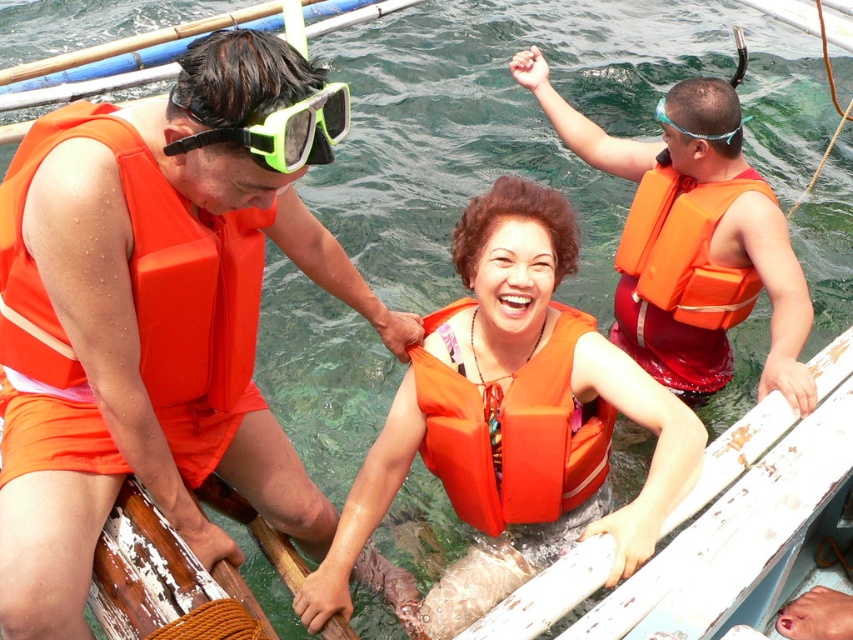
Question: Is orange life vest at center bigger than teal plastic goggles at upper center?

Choices:
 (A) yes
 (B) no

Answer: (B)

Question: Is the position of orange foam life jacket at left less distant than that of orange matte life jacket at right?

Choices:
 (A) no
 (B) yes

Answer: (B)

Question: Which of the following is the closest to the observer?

Choices:
 (A) (672, 100)
 (B) (647, 508)
 (C) (267, 116)
 (D) (461, 410)

Answer: (C)

Question: Estimate the real-world distances between objects in this image. Which object is closer to the orange matte life jacket at right?

Choices:
 (A) orange foam life jacket at left
 (B) teal plastic goggles at upper center

Answer: (B)

Question: Can you confirm if orange life vest at center is positioned below teal plastic goggles at upper center?

Choices:
 (A) no
 (B) yes

Answer: (B)

Question: Which point is closer to the camera?

Choices:
 (A) orange matte life jacket at center
 (B) orange matte life jacket at right
 (C) orange life vest at upper right

Answer: (C)